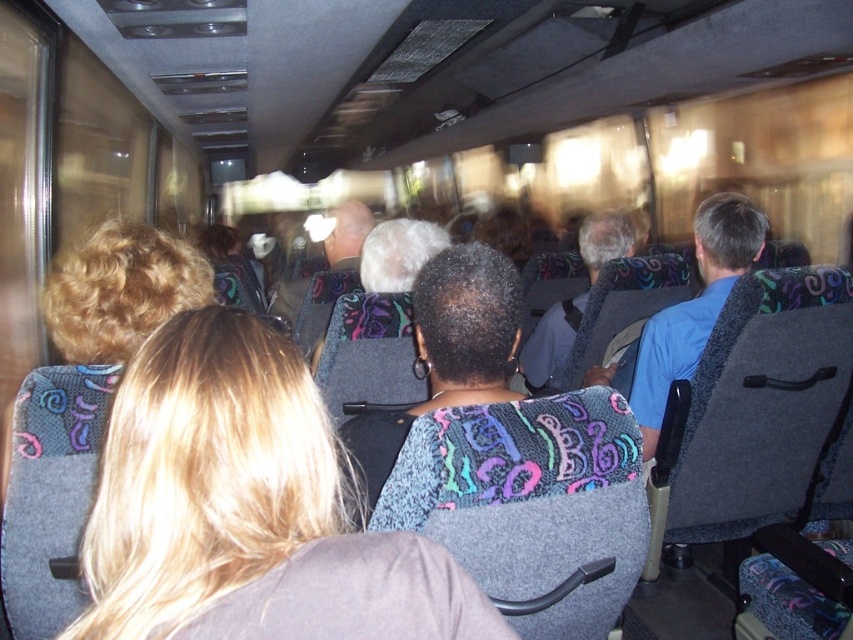
Question: Does multicolored fabric headrest at center have a smaller size compared to gray fabric jacket at center?

Choices:
 (A) yes
 (B) no

Answer: (A)

Question: Can you confirm if blonde hair at center is bigger than gray fabric jacket at center?

Choices:
 (A) no
 (B) yes

Answer: (A)

Question: Which object is positioned farthest from the blonde hair at center?

Choices:
 (A) multicolored fabric headrest at center
 (B) gray fabric jacket at center

Answer: (B)

Question: Among these objects, which one is farthest from the camera?

Choices:
 (A) gray fabric jacket at center
 (B) blonde hair at center

Answer: (A)

Question: Can you confirm if blonde hair at center is positioned to the right of gray fabric jacket at center?

Choices:
 (A) no
 (B) yes

Answer: (A)

Question: Which object is closer to the camera taking this photo?

Choices:
 (A) multicolored fabric headrest at center
 (B) blonde hair at center

Answer: (B)